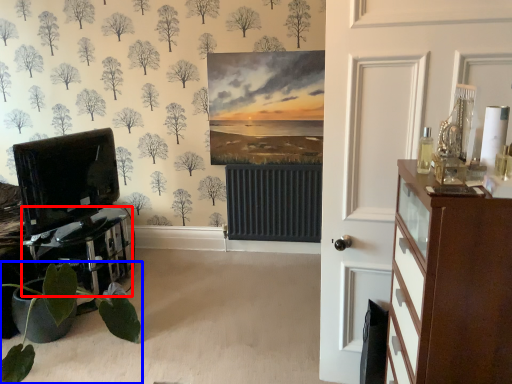
Question: Which point is closer to the camera, table (highlighted by a red box) or houseplant (highlighted by a blue box)?

Choices:
 (A) table
 (B) houseplant

Answer: (B)